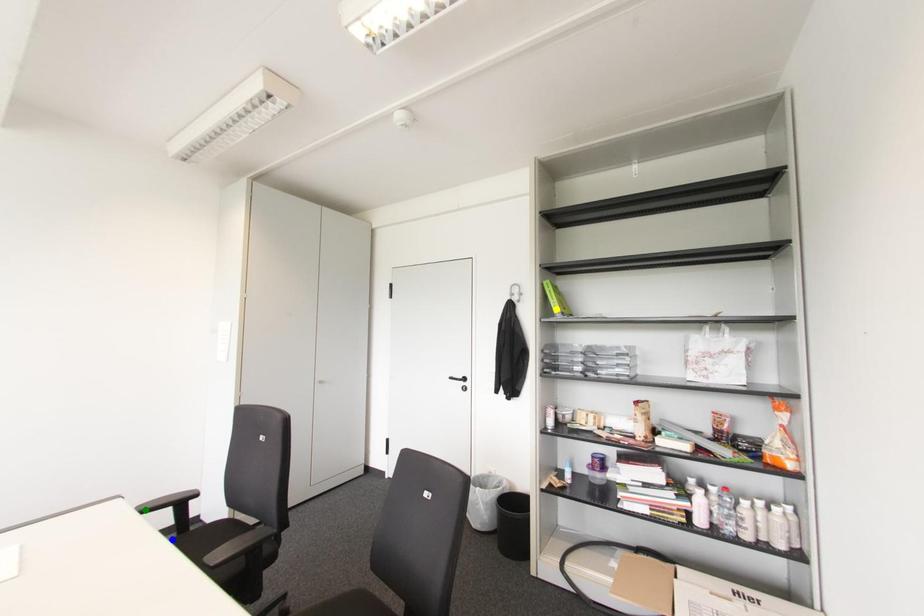
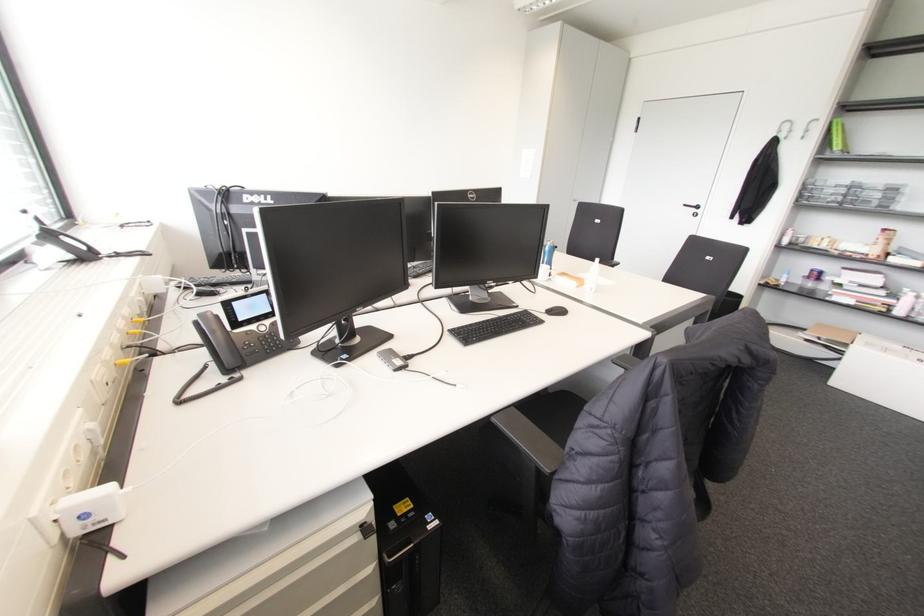
I am providing you with two images of the same scene from different viewpoints. Three points are marked in image1. Which point corresponds to a part or object that is occluded in image2?In image1, three points are marked. Which of them correspond to a part or object that is occluded in image2?Among the three points shown in image1, which one corresponds to a part or object that is no longer visible due to occlusion in image2?

Invisible in image2: green point, blue point.